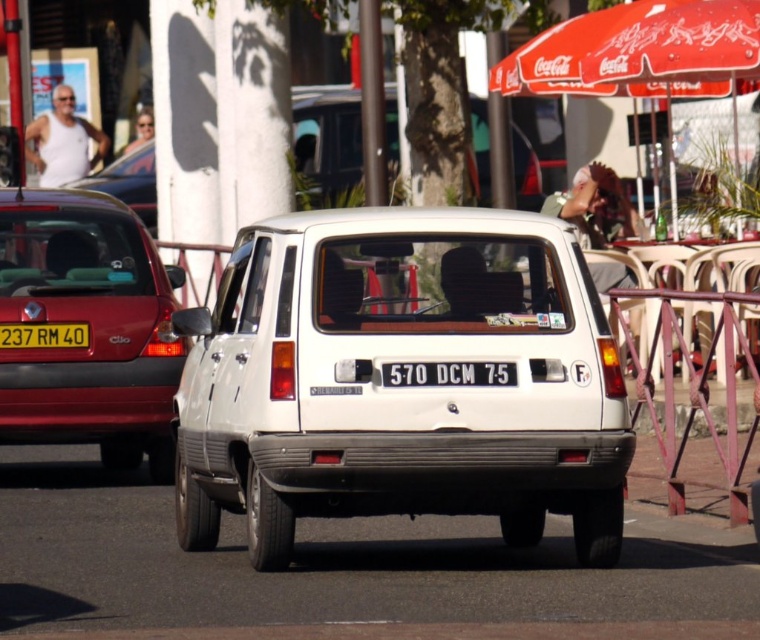
Who is more forward, (x=119, y=240) or (x=331, y=189)?

Point (x=119, y=240)

Is metallic red hatchback at left below white matte hatchback at center?

Yes.

The image size is (760, 640). What are the coordinates of `metallic red hatchback at left` in the screenshot? It's located at (89, 328).

Does point (287, 554) come in front of point (293, 132)?

Yes, point (287, 554) is in front of point (293, 132).

In the scene shown: Is white matte van at center shorter than white matte hatchback at center?

Indeed, white matte van at center has a lesser height compared to white matte hatchback at center.

Locate an element on the screen. white matte van at center is located at coordinates (401, 387).

Looking at this image, is metallic red hatchback at left behind yellow matte license plate at center?

No, it is not.

Who is lower down, metallic red hatchback at left or yellow matte license plate at center?

yellow matte license plate at center is below.

Locate an element on the screen. This screenshot has height=640, width=760. metallic red hatchback at left is located at coordinates (89, 328).

The image size is (760, 640). In order to click on metallic red hatchback at left in this screenshot , I will do `click(89, 328)`.